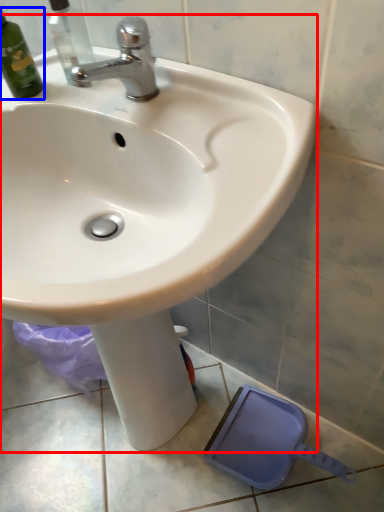
Question: Among these objects, which one is nearest to the camera, sink (highlighted by a red box) or bottle (highlighted by a blue box)?

Choices:
 (A) sink
 (B) bottle

Answer: (A)